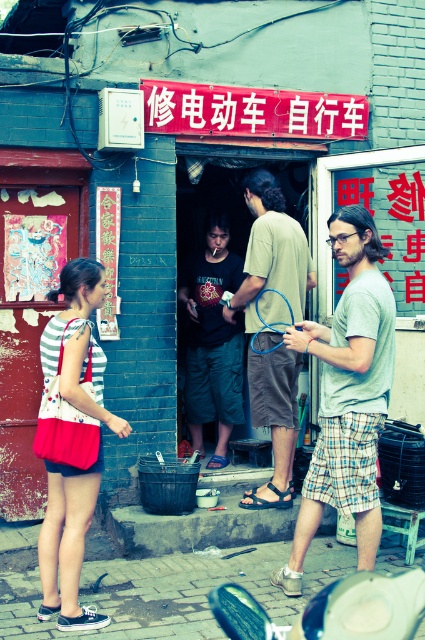
Who is taller, striped fabric dress at center or dark blue cotton shorts at center?

Standing taller between the two is dark blue cotton shorts at center.

Between striped fabric dress at center and dark blue cotton shorts at center, which one is positioned higher?

dark blue cotton shorts at center is higher up.

The height and width of the screenshot is (640, 425). Describe the element at coordinates (68, 538) in the screenshot. I see `striped fabric dress at center` at that location.

Locate an element on the screen. The image size is (425, 640). striped fabric dress at center is located at coordinates (68, 538).

Measure the distance between point (x=221, y=419) and camera.

Point (x=221, y=419) is 6.41 meters away from camera.

Does point (214, 268) lie behind point (257, 508)?

Yes, it is behind point (257, 508).

Does point (214, 253) come behind point (261, 500)?

Yes.

This screenshot has height=640, width=425. In order to click on dark blue cotton shorts at center in this screenshot , I will do `click(212, 339)`.

Looking at this image, is light gray cotton t-shirt at center to the left of striped fabric dress at center from the viewer's perspective?

In fact, light gray cotton t-shirt at center is to the right of striped fabric dress at center.

Is light gray cotton t-shirt at center further to the viewer compared to striped fabric dress at center?

Yes, it is.

The width and height of the screenshot is (425, 640). Identify the location of light gray cotton t-shirt at center. (348, 394).

You are a GUI agent. You are given a task and a screenshot of the screen. Output one action in this format:
    pyautogui.click(x=<x>, y=<y>)
    Task: Click on the light gray cotton t-shirt at center
    Image resolution: width=425 pixels, height=640 pixels.
    Given the screenshot: What is the action you would take?
    pyautogui.click(x=348, y=394)